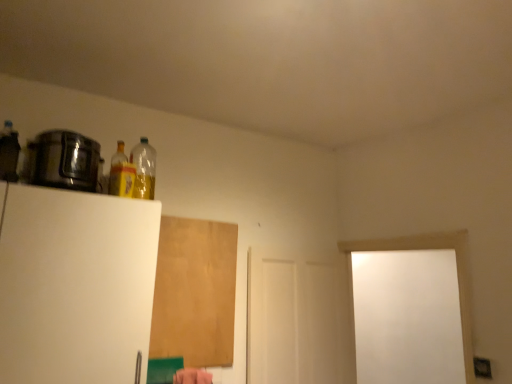
This screenshot has width=512, height=384. Describe the element at coordinates (297, 320) in the screenshot. I see `white matte door at center` at that location.

Describe the element at coordinates (144, 169) in the screenshot. I see `translucent plastic bottle at upper left, the 3th bottle when ordered from left to right` at that location.

Locate an element on the screen. This screenshot has width=512, height=384. translucent yellow bottle at upper left, arranged as the second bottle when viewed from the left is located at coordinates (121, 174).

What is the approximate width of matte black bottle at upper left, which is counted as the 1th bottle, starting from the front?

matte black bottle at upper left, which is counted as the 1th bottle, starting from the front, is 3.73 inches wide.

You are a GUI agent. You are given a task and a screenshot of the screen. Output one action in this format:
    pyautogui.click(x=<x>, y=<y>)
    Task: Click on the brown matte plywood at upper center
    
    Given the screenshot: What is the action you would take?
    pyautogui.click(x=195, y=292)

Where is `white matte door at center`? The image size is (512, 384). white matte door at center is located at coordinates (297, 320).

Looking at this image, how many degrees apart are the facing directions of brown matte plywood at upper center and translucent yellow bottle at upper left, arranged as the second bottle when viewed from the left?

There is a 4.06-degree angle between the facing directions of brown matte plywood at upper center and translucent yellow bottle at upper left, arranged as the second bottle when viewed from the left.

Considering the sizes of objects brown matte plywood at upper center and translucent yellow bottle at upper left, arranged as the second bottle when viewed from the left, in the image provided, who is bigger, brown matte plywood at upper center or translucent yellow bottle at upper left, arranged as the second bottle when viewed from the left,?

With larger size is brown matte plywood at upper center.

Which of these two, brown matte plywood at upper center or translucent yellow bottle at upper left, arranged as the 2th bottle when viewed from the right, stands taller?

brown matte plywood at upper center.

From the image's perspective, who appears lower, brown matte plywood at upper center or translucent yellow bottle at upper left, the second bottle from the front?

From the image's view, brown matte plywood at upper center is below.

Considering the sizes of objects white matte door at center and brown matte plywood at upper center in the image provided, who is smaller, white matte door at center or brown matte plywood at upper center?

brown matte plywood at upper center.

Is white matte door at center far away from brown matte plywood at upper center?

Actually, white matte door at center and brown matte plywood at upper center are a little close together.

From the picture: Which is in front, white matte door at center or brown matte plywood at upper center?

brown matte plywood at upper center.

Can you tell me how much white matte door at center and brown matte plywood at upper center differ in facing direction?

The angular difference between white matte door at center and brown matte plywood at upper center is 1.24 degrees.

Based on the photo, is matte black bottle at upper left, marked as the 1th bottle in a left-to-right arrangement, shorter than brown matte plywood at upper center?

Indeed, matte black bottle at upper left, marked as the 1th bottle in a left-to-right arrangement, has a lesser height compared to brown matte plywood at upper center.

How different are the orientations of matte black bottle at upper left, which is counted as the 1th bottle, starting from the front, and brown matte plywood at upper center in degrees?

The angle between the facing direction of matte black bottle at upper left, which is counted as the 1th bottle, starting from the front, and the facing direction of brown matte plywood at upper center is 2.99 degrees.

Which is in front, point (9, 159) or point (174, 321)?

The point (9, 159) is closer.

Looking at this image, is matte black bottle at upper left, the 3th bottle viewed from the back, oriented away from white matte door at right?

No, white matte door at right is not at the back of matte black bottle at upper left, the 3th bottle viewed from the back.

Does matte black bottle at upper left, the 3th bottle viewed from the back, have a lesser height compared to white matte door at right?

Yes.

What's the angular difference between matte black bottle at upper left, marked as the 1th bottle in a left-to-right arrangement, and white matte door at right's facing directions?

There is a 77.2-degree angle between the facing directions of matte black bottle at upper left, marked as the 1th bottle in a left-to-right arrangement, and white matte door at right.

The height and width of the screenshot is (384, 512). What are the coordinates of `door below the matte black bottle at upper left, marked as the 1th bottle in a left-to-right arrangement (from a real-world perspective)` in the screenshot? It's located at (426, 249).

What's the angular difference between brown matte plywood at upper center and shiny metallic pot at left, the second appliance when ordered from bottom to top,'s facing directions?

2.99 degrees.

Measure the distance from brown matte plywood at upper center to shiny metallic pot at left, arranged as the 1th appliance when viewed from the top.

The distance of brown matte plywood at upper center from shiny metallic pot at left, arranged as the 1th appliance when viewed from the top, is 31.76 inches.

Is brown matte plywood at upper center looking in the opposite direction of shiny metallic pot at left, the second appliance when ordered from bottom to top?

No, brown matte plywood at upper center's orientation is not away from shiny metallic pot at left, the second appliance when ordered from bottom to top.

Does brown matte plywood at upper center have a smaller size compared to shiny metallic pot at left, arranged as the 1th appliance when viewed from the top?

Yes.

From the image's perspective, is white matte refrigerator at left, the first appliance positioned from the bottom, on brown matte plywood at upper center?

Yes.

Can you tell me how much white matte refrigerator at left, which is the 2th appliance from top to bottom, and brown matte plywood at upper center differ in facing direction?

There is a 0.0822-degree angle between the facing directions of white matte refrigerator at left, which is the 2th appliance from top to bottom, and brown matte plywood at upper center.

Would you say white matte refrigerator at left, which is the 2th appliance from top to bottom, is inside or outside brown matte plywood at upper center?

white matte refrigerator at left, which is the 2th appliance from top to bottom, is outside brown matte plywood at upper center.

Considering the sizes of objects white matte door at center and matte black bottle at upper left, marked as the 1th bottle in a left-to-right arrangement, in the image provided, who is bigger, white matte door at center or matte black bottle at upper left, marked as the 1th bottle in a left-to-right arrangement,?

With larger size is white matte door at center.

Which object is thinner, white matte door at center or matte black bottle at upper left, the 3th bottle viewed from the back?

→ matte black bottle at upper left, the 3th bottle viewed from the back, is thinner.

Is point (313, 314) less distant than point (7, 152)?

No, (313, 314) is behind (7, 152).

Is white matte door at center in contact with matte black bottle at upper left, which is counted as the 1th bottle, starting from the front?

white matte door at center is not next to matte black bottle at upper left, which is counted as the 1th bottle, starting from the front, and they're not touching.

Find the location of a particular element. The height and width of the screenshot is (384, 512). plywood lying on the right of translucent yellow bottle at upper left, arranged as the 2th bottle when viewed from the right is located at coordinates (195, 292).

You are a GUI agent. You are given a task and a screenshot of the screen. Output one action in this format:
    pyautogui.click(x=<x>, y=<y>)
    Task: Click on the screen door that appears below the brown matte plywood at upper center (from the image's perspective)
    The width and height of the screenshot is (512, 384).
    Given the screenshot: What is the action you would take?
    pyautogui.click(x=297, y=320)

Considering their positions, is translucent plastic bottle at upper left, acting as the 1th bottle starting from the back, positioned closer to white matte door at center than translucent yellow bottle at upper left, which is the 2th bottle in back-to-front order?

Based on the image, translucent plastic bottle at upper left, acting as the 1th bottle starting from the back, appears to be nearer to white matte door at center.

When comparing their distances from shiny metallic pot at left, arranged as the 1th appliance when viewed from the top, does white matte door at center or brown matte plywood at upper center seem closer?

brown matte plywood at upper center is closer to shiny metallic pot at left, arranged as the 1th appliance when viewed from the top.

Estimate the real-world distances between objects in this image. Which object is further from white matte refrigerator at left, which is the 2th appliance from top to bottom, translucent yellow bottle at upper left, arranged as the second bottle when viewed from the left, or translucent plastic bottle at upper left, the 3th bottle when ordered from left to right?

translucent plastic bottle at upper left, the 3th bottle when ordered from left to right, is positioned further to the anchor white matte refrigerator at left, which is the 2th appliance from top to bottom.

Based on their spatial positions, is white matte door at right or translucent yellow bottle at upper left, arranged as the second bottle when viewed from the left, closer to white matte door at center?

Based on the image, white matte door at right appears to be nearer to white matte door at center.

Looking at this image, estimate the real-world distances between objects in this image. Which object is closer to white matte door at center, shiny metallic pot at left, the second appliance when ordered from bottom to top, or brown matte plywood at upper center?

brown matte plywood at upper center.

When comparing their distances from white matte refrigerator at left, the first appliance positioned from the bottom, does white matte door at center or brown matte plywood at upper center seem closer?

brown matte plywood at upper center.

From the picture: Based on their spatial positions, is translucent plastic bottle at upper left, acting as the 1th bottle starting from the back, or translucent yellow bottle at upper left, the second bottle from the front, closer to white matte door at right?

Among the two, translucent plastic bottle at upper left, acting as the 1th bottle starting from the back, is located nearer to white matte door at right.

Based on their spatial positions, is white matte refrigerator at left, the first appliance positioned from the bottom, or brown matte plywood at upper center further from translucent yellow bottle at upper left, the second bottle from the front?

The object further to translucent yellow bottle at upper left, the second bottle from the front, is brown matte plywood at upper center.

Where is `appliance between matte black bottle at upper left, marked as the 1th bottle in a left-to-right arrangement, and white matte refrigerator at left, the first appliance positioned from the bottom, vertically`? appliance between matte black bottle at upper left, marked as the 1th bottle in a left-to-right arrangement, and white matte refrigerator at left, the first appliance positioned from the bottom, vertically is located at coordinates (64, 160).

The image size is (512, 384). In order to click on bottle between shiny metallic pot at left, arranged as the 1th appliance when viewed from the top, and white matte refrigerator at left, the first appliance positioned from the bottom, from top to bottom in this screenshot , I will do `click(121, 174)`.

Find the location of a particular element. The height and width of the screenshot is (384, 512). plywood between matte black bottle at upper left, marked as the 1th bottle in a left-to-right arrangement, and white matte door at center is located at coordinates (195, 292).

The image size is (512, 384). Identify the location of plywood between white matte refrigerator at left, which is the 2th appliance from top to bottom, and white matte door at center, in the horizontal direction. (195, 292).